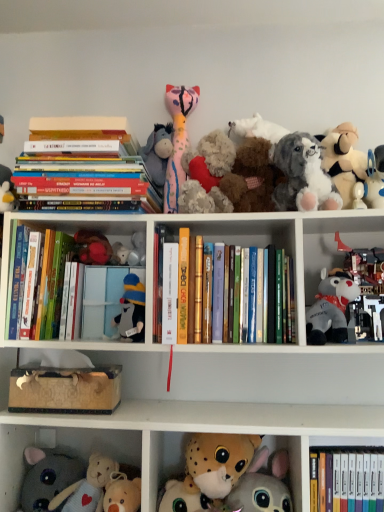
Find the location of a particular element. Image resolution: width=384 pixels, height=512 pixels. free space above hardcover books at upper left, which ranks as the first book in top-to-bottom order (from a real-world perspective) is located at coordinates (81, 148).